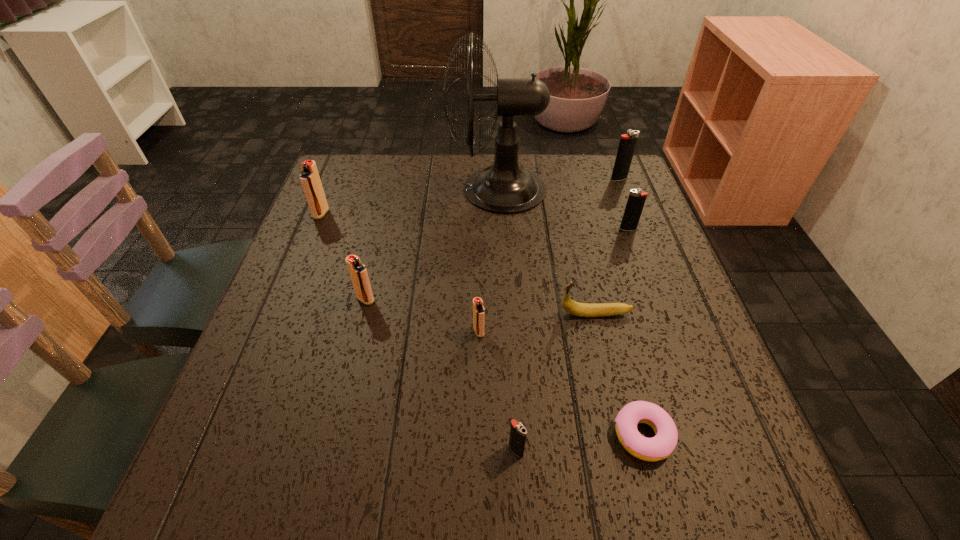
The width and height of the screenshot is (960, 540). Find the location of `fan present at the far edge`. fan present at the far edge is located at coordinates (505, 188).

The width and height of the screenshot is (960, 540). Find the location of `igniter present at the far edge`. igniter present at the far edge is located at coordinates (627, 144).

At what (x,y) coordinates should I click in order to perform the action: click on igniter that is at the near edge. Please return your answer as a coordinate pair (x, y). Looking at the image, I should click on (518, 432).

Locate an element on the screen. The width and height of the screenshot is (960, 540). doughnut at the near edge is located at coordinates (659, 447).

Where is `object positioned at the left edge`? object positioned at the left edge is located at coordinates point(310,180).

The height and width of the screenshot is (540, 960). Find the location of `banana that is at the right edge`. banana that is at the right edge is located at coordinates [572, 307].

Identify the location of doughnut at the right edge. The image size is (960, 540). (659, 447).

In order to click on object that is at the far right corner in this screenshot , I will do `click(627, 144)`.

This screenshot has width=960, height=540. In order to click on object located at the near right corner in this screenshot , I will do `click(659, 447)`.

The height and width of the screenshot is (540, 960). In the image, there is a desktop. What are the coordinates of `vacant space at the far edge` in the screenshot? It's located at (557, 197).